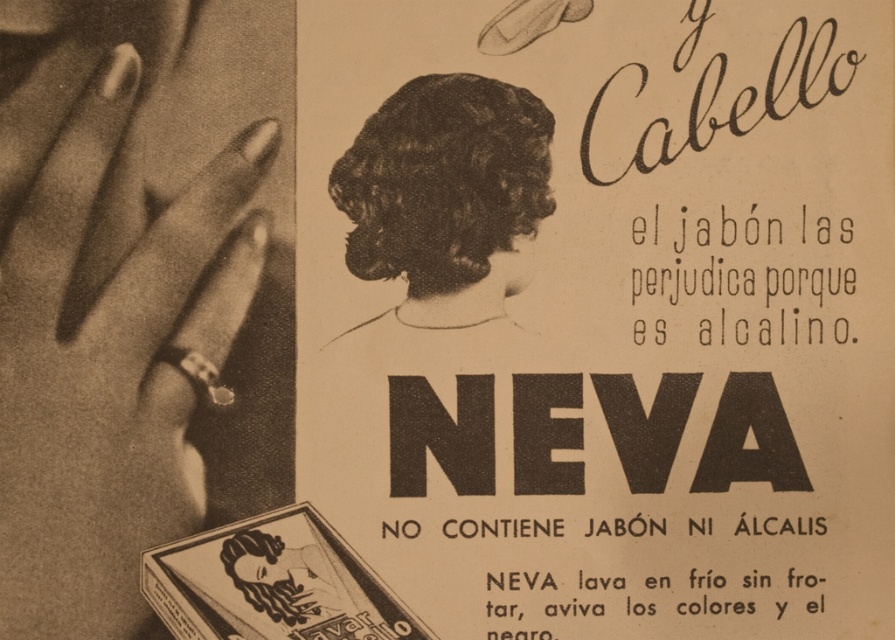
In the scene shown: You are designing a layout for a new advertisement and want to place a logo in the bottom right corner. Given the current placement of the matte paper advertisement at center, will the logo overlap with it?

The matte paper advertisement at center is located at point (608, 310), so placing a logo in the bottom right corner would not overlap with it since the coordinates are different.

You are an artist trying to recreate this vintage advertisement. You notice two points in the image at coordinates point (146, 612) and point (486, 300). Which point is positioned closer to the viewer?

Point (146, 612) is closer to the camera than point (486, 300).